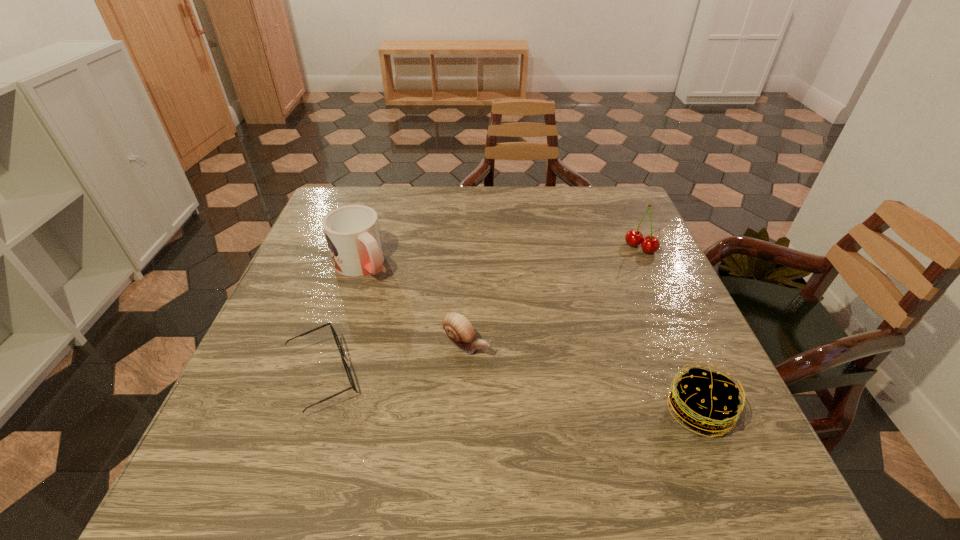
Locate an element on the screen. This screenshot has width=960, height=540. vacant space at the far right corner is located at coordinates (630, 215).

Locate an element on the screen. free space between the patty and the spectacles is located at coordinates (510, 393).

Locate an element on the screen. free area in between the cherry and the spectacles is located at coordinates (481, 312).

Image resolution: width=960 pixels, height=540 pixels. I want to click on vacant space that's between the patty and the escargot, so click(x=583, y=378).

Where is `vacant area that lies between the shortest object and the third tallest object`? This screenshot has height=540, width=960. vacant area that lies between the shortest object and the third tallest object is located at coordinates (510, 393).

Where is `vacant point located between the patty and the escargot`? Image resolution: width=960 pixels, height=540 pixels. vacant point located between the patty and the escargot is located at coordinates (583, 378).

At what (x,y) coordinates should I click in order to perform the action: click on blank region between the cherry and the patty. Please return your answer as a coordinate pair (x, y). This screenshot has width=960, height=540. Looking at the image, I should click on (669, 329).

At what (x,y) coordinates should I click in order to perform the action: click on free point between the cherry and the third tallest object. Please return your answer as a coordinate pair (x, y). Looking at the image, I should click on (669, 329).

The image size is (960, 540). Identify the location of vacant area that lies between the spectacles and the mug. (342, 320).

The width and height of the screenshot is (960, 540). I want to click on vacant area that lies between the second shortest object and the shortest object, so click(395, 361).